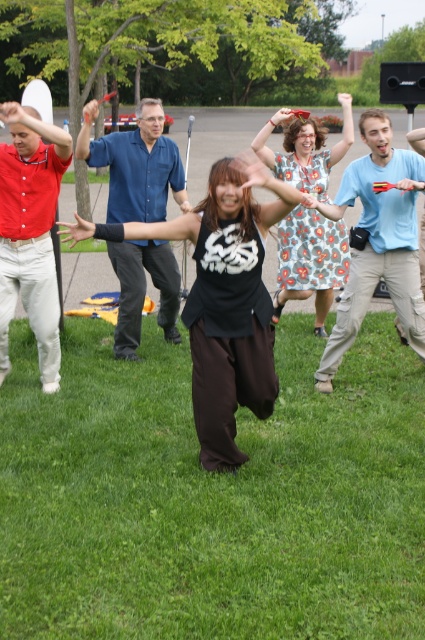
Question: In this image, where is green grass at center located relative to light blue cotton shirt at center?

Choices:
 (A) above
 (B) below

Answer: (B)

Question: Does black matte shirt at center have a smaller size compared to light blue cotton shirt at center?

Choices:
 (A) yes
 (B) no

Answer: (A)

Question: Which object appears farthest from the camera in this image?

Choices:
 (A) black matte shirt at center
 (B) floral dress at center
 (C) light blue cotton shirt at center
 (D) green grass at center

Answer: (C)

Question: Which object is farther from the camera taking this photo?

Choices:
 (A) black matte wristband at center
 (B) green grass at center
 (C) blue button-down shirt at center
 (D) light blue cotton shirt at center

Answer: (C)

Question: Which point is farther from the camera taking this photo?

Choices:
 (A) (243, 182)
 (B) (280, 568)
 (C) (317, 292)
 (D) (59, 356)

Answer: (C)

Question: Is green grass at center to the left of matte red shirt at left from the viewer's perspective?

Choices:
 (A) yes
 (B) no

Answer: (B)